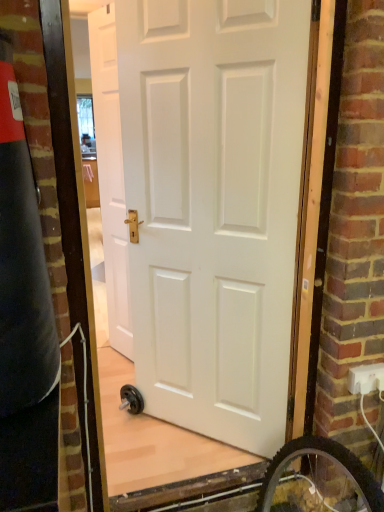
Question: Is white plastic electric outlet at lower right inside the boundaries of white matte door at center, the 2th door from the back, or outside?

Choices:
 (A) inside
 (B) outside

Answer: (B)

Question: From a real-world perspective, is white plastic electric outlet at lower right positioned above or below white matte door at center, arranged as the 1th door when viewed from the right?

Choices:
 (A) below
 (B) above

Answer: (A)

Question: Considering the real-world distances, which object is farthest from the white matte door at center, the 2th door from the back?

Choices:
 (A) white plastic electric outlet at lower right
 (B) white matte door at center, which is the first door in left-to-right order

Answer: (A)

Question: Based on their relative distances, which object is nearer to the white matte door at center, which is the 1th door in back-to-front order?

Choices:
 (A) white plastic electric outlet at lower right
 (B) white matte door at center, which is the 1th door in front-to-back order

Answer: (B)